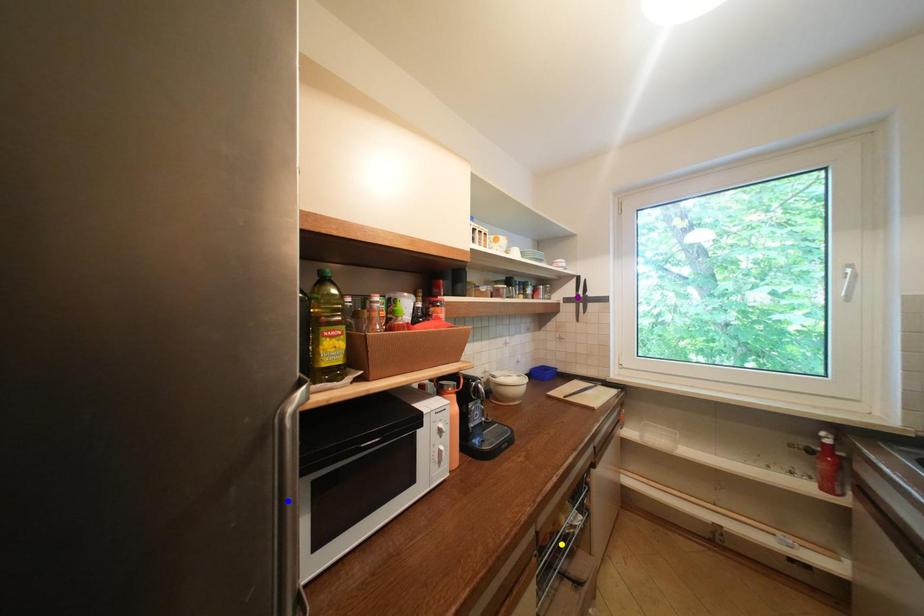
In the scene shown: Order these from nearest to farthest:
yellow point, blue point, purple point

blue point
yellow point
purple point